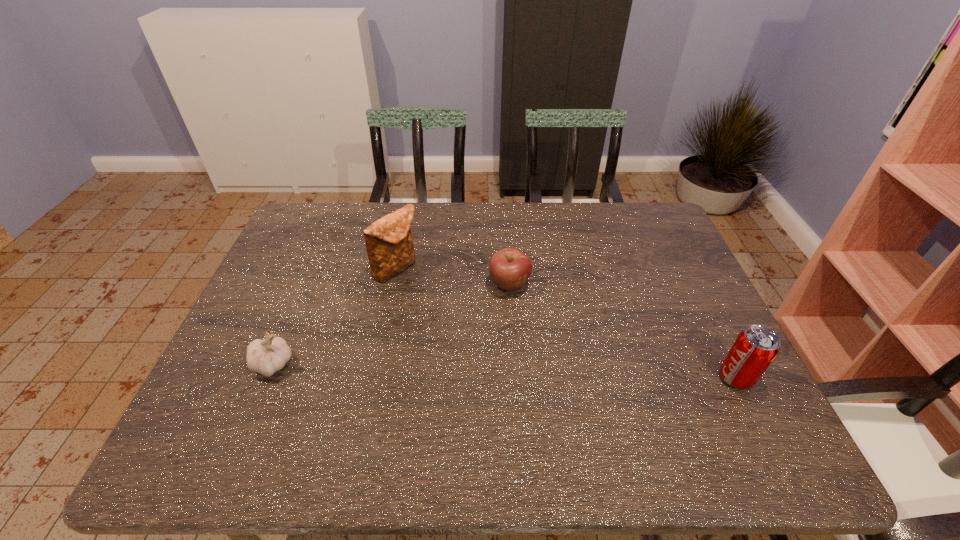
The width and height of the screenshot is (960, 540). What are the coordinates of `vacant space that satisfies the following two spatial constraints: 1. on the back side of the third object from right to left; 2. on the left side of the garlic` in the screenshot? It's located at (312, 269).